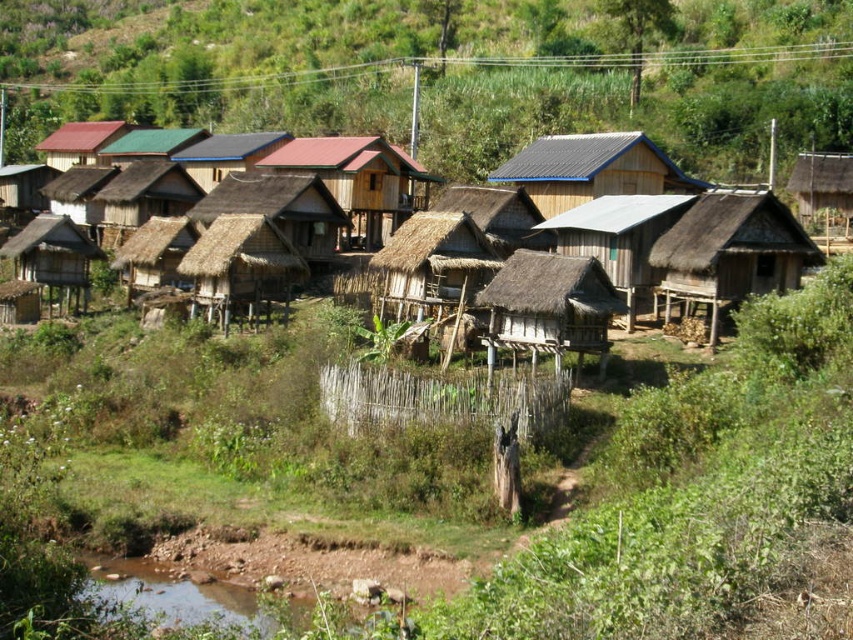
Question: Is brown thatch hut at upper right wider than smooth dark blue roof at center?

Choices:
 (A) no
 (B) yes

Answer: (A)

Question: Does brown thatch hut at right appear on the right side of matte wooden hut at center?

Choices:
 (A) yes
 (B) no

Answer: (A)

Question: Which object is closer to the camera taking this photo?

Choices:
 (A) smooth dark blue roof at center
 (B) brown thatched hut at center

Answer: (B)

Question: Is thatched wood hut at left further to the viewer compared to matte brown thatched hut at upper left?

Choices:
 (A) no
 (B) yes

Answer: (A)

Question: Which object is farther from the camera taking this photo?

Choices:
 (A) thatched wood hut at left
 (B) brown thatch hut at right
 (C) brown thatch hut at upper right

Answer: (C)

Question: Which of the following is the closest to the observer?

Choices:
 (A) (750, 172)
 (B) (564, 198)

Answer: (B)